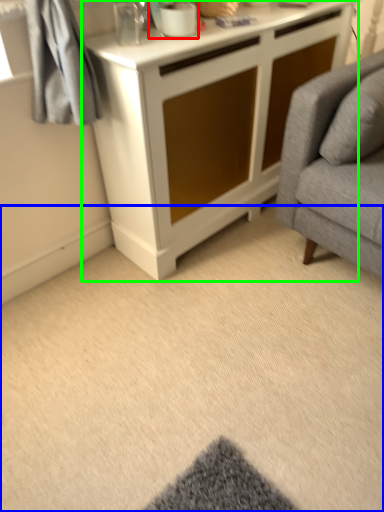
Question: Which object is the farthest from appliance (highlighted by a red box)? Choose among these: plain (highlighted by a blue box) or cabinetry (highlighted by a green box).

Choices:
 (A) plain
 (B) cabinetry

Answer: (A)